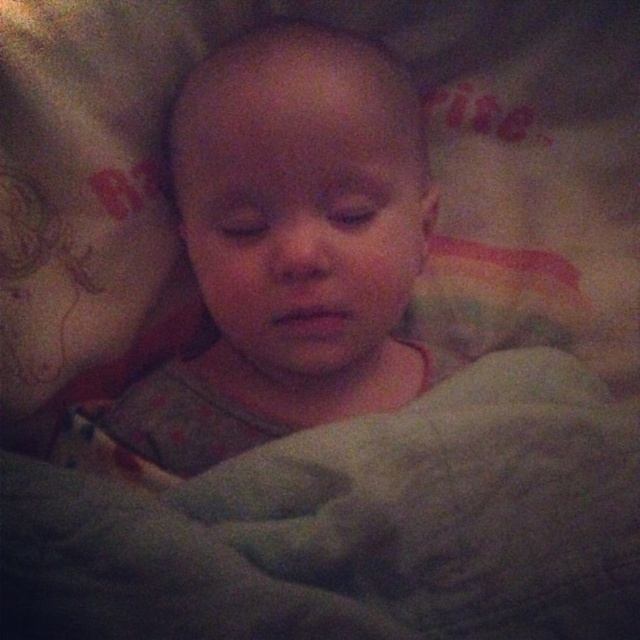
You are looking at the baby in the image. There are two points marked on the baby, one at coordinates point (129, 531) and the other at point (388, 212). Which point is closer to you?

Point (129, 531) is closer to the viewer than point (388, 212).

Based on the scene description, can you determine which object is taller between the soft gray fabric at lower center and the smooth gray baby at center?

The smooth gray baby at center is taller than the soft gray fabric at lower center.

You are an interior designer analyzing the composition of the image. The soft gray fabric at lower center is part of the background. Can you determine its exact position in terms of coordinates?

The 2D location of the soft gray fabric at lower center is at point (355, 525).